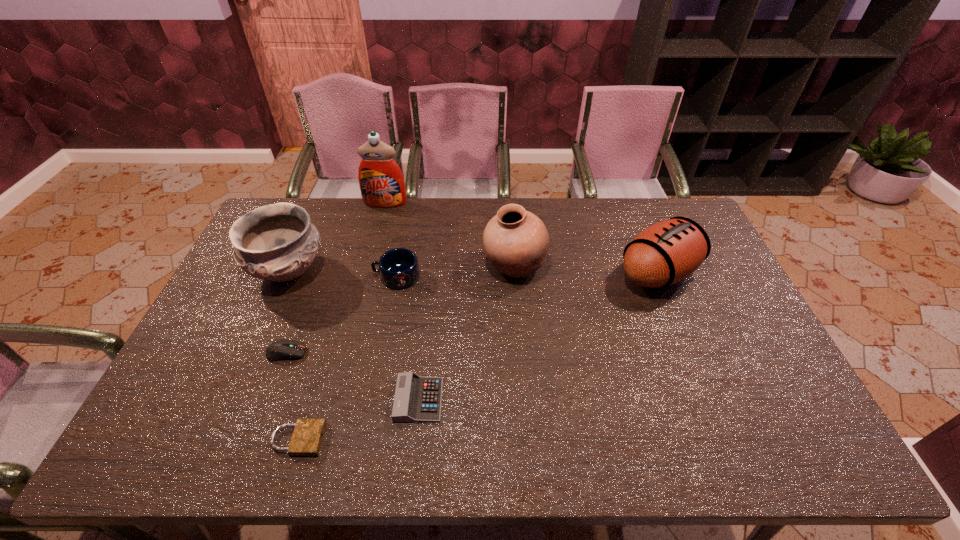
I want to click on object situated at the far edge, so click(381, 181).

This screenshot has width=960, height=540. What are the coordinates of `object that is at the near edge` in the screenshot? It's located at (307, 437).

Image resolution: width=960 pixels, height=540 pixels. In order to click on object that is at the left edge in this screenshot , I will do `click(277, 242)`.

Locate an element on the screen. object that is at the right edge is located at coordinates (667, 252).

The height and width of the screenshot is (540, 960). Identify the location of vacant space at the far edge of the desktop. (548, 211).

The height and width of the screenshot is (540, 960). In order to click on free location at the near edge of the desktop in this screenshot , I will do `click(710, 455)`.

The width and height of the screenshot is (960, 540). Find the location of `vacant space at the left edge of the desktop`. vacant space at the left edge of the desktop is located at coordinates (235, 354).

Identify the location of free space at the right edge of the desktop. The height and width of the screenshot is (540, 960). (736, 295).

The image size is (960, 540). I want to click on free spot between the sixth farthest object and the football (American), so click(472, 313).

I want to click on vacant space that is in between the fifth tallest object and the left pottery, so click(x=343, y=274).